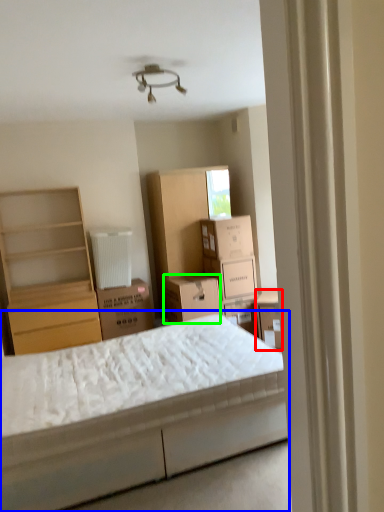
Question: Which object is positioned closest to storage box (highlighted by a red box)? Select from bed (highlighted by a blue box) and storage box (highlighted by a green box).

Choices:
 (A) bed
 (B) storage box

Answer: (B)